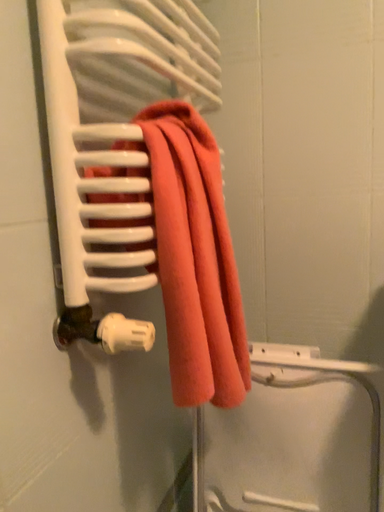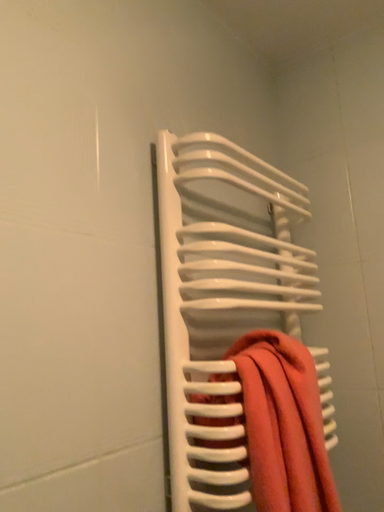
Question: Which way did the camera rotate in the video?

Choices:
 (A) rotated right
 (B) rotated left

Answer: (B)